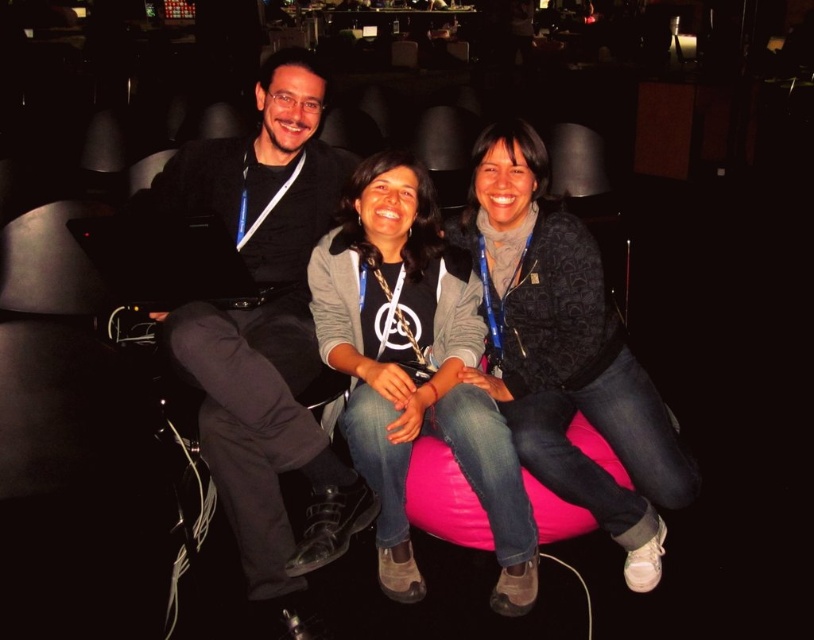
You are organizing a clothing donation drive and need to categorize items by size. You have a black matte jacket at upper left and a matte black shirt at center. Which item should be placed in the large size bin?

The black matte jacket at upper left should be placed in the large size bin because it has a larger size compared to the matte black shirt at center.

You are standing in the lounge and need to locate the black matte jacket at upper left. According to the coordinates provided, where exactly is it positioned in the image?

The black matte jacket at upper left is located at point coordinates of (265, 330).

You are trying to take a photo of the pink fabric bean bag at center but the black matte jacket at upper left is blocking your view. Can you move the jacket to get a clear shot?

The black matte jacket at upper left is in front of the pink fabric bean bag at center, so moving it would allow you to see the bean bag clearly.